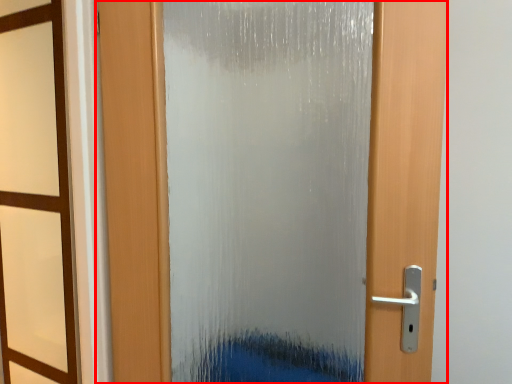
Question: From the image's perspective, considering the relative positions of door (annotated by the red box) and window frame in the image provided, where is door (annotated by the red box) located with respect to the staircase?

Choices:
 (A) below
 (B) above

Answer: (B)